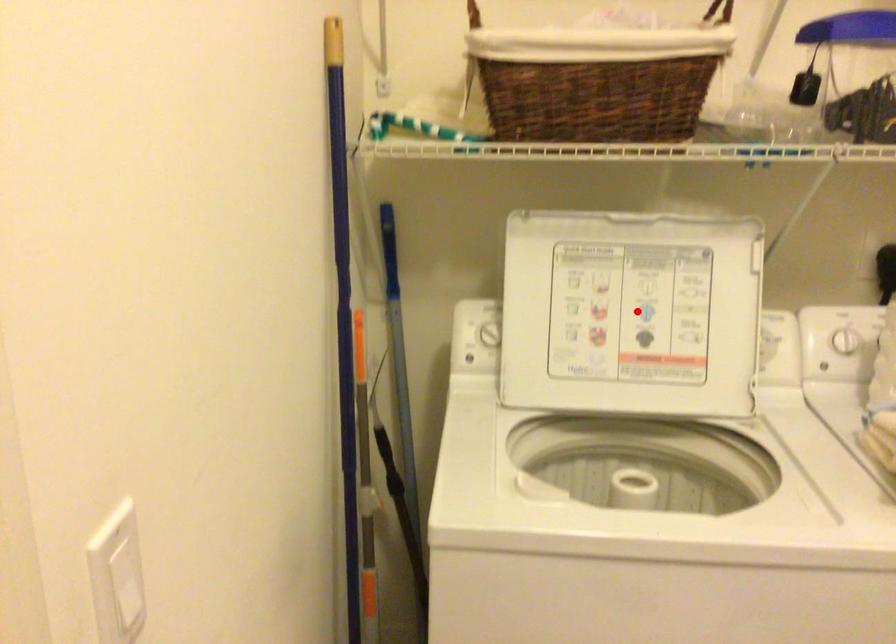
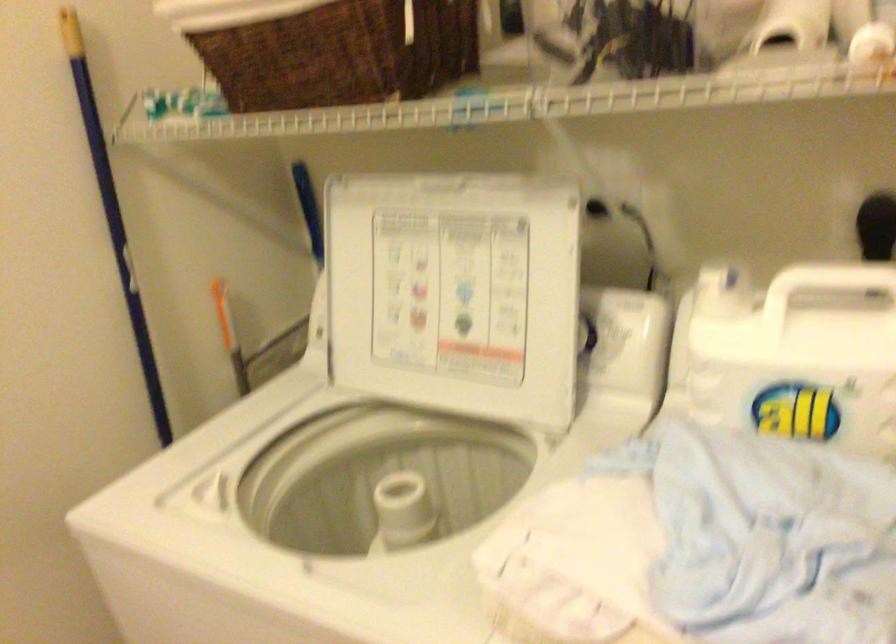
The point at the highlighted location is marked in the first image. Where is the corresponding point in the second image?

(454, 292)